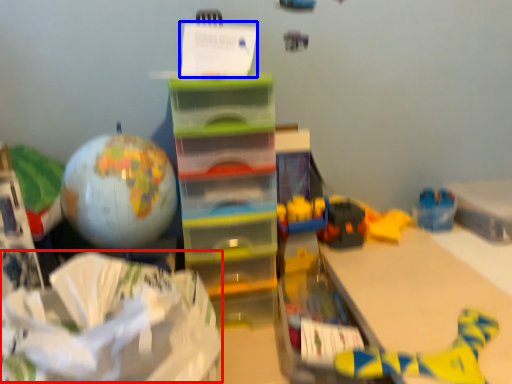
Question: Which object appears farthest to the camera in this image, wrapping paper (highlighted by a red box) or writing (highlighted by a blue box)?

Choices:
 (A) wrapping paper
 (B) writing

Answer: (B)